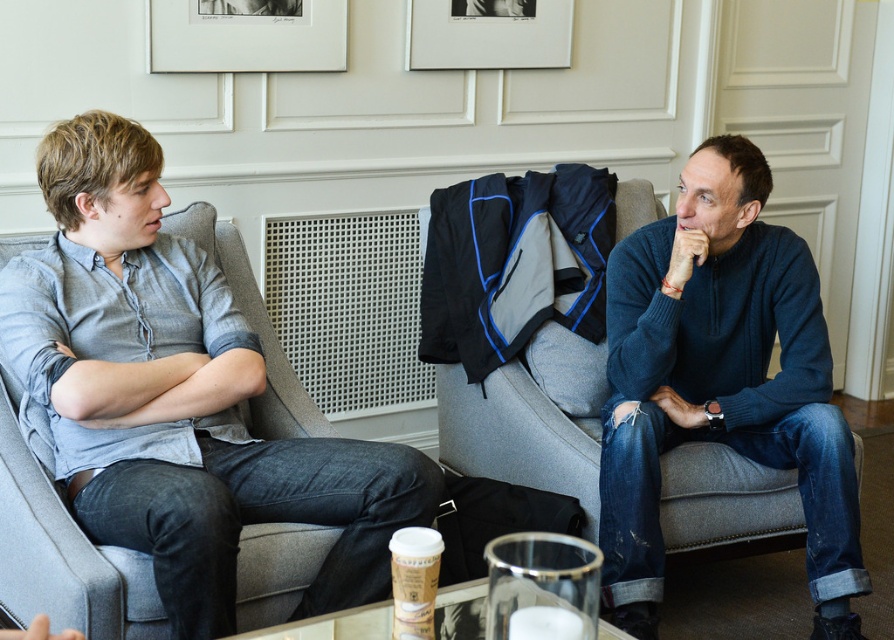
Question: Which of the following is the closest to the observer?

Choices:
 (A) dark blue sweater at right
 (B) white matte picture frame at upper center
 (C) matte white picture frame at upper center

Answer: (A)

Question: Can you confirm if matte white picture frame at upper center is bigger than white matte picture frame at upper center?

Choices:
 (A) yes
 (B) no

Answer: (A)

Question: Considering the real-world distances, which object is farthest from the white matte picture frame at upper center?

Choices:
 (A) dark blue sweater at right
 (B) matte white picture frame at upper center
 (C) light gray shirt at left

Answer: (C)

Question: Which point is farther to the camera?

Choices:
 (A) (519, 58)
 (B) (831, 444)

Answer: (A)

Question: Can you confirm if matte white picture frame at upper center is wider than white matte picture frame at upper center?

Choices:
 (A) no
 (B) yes

Answer: (A)

Question: Does light gray shirt at left appear on the left side of dark blue sweater at right?

Choices:
 (A) yes
 (B) no

Answer: (A)